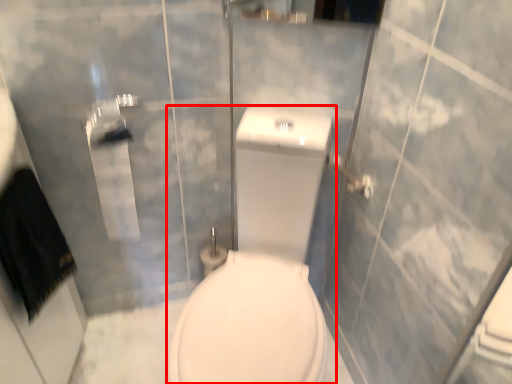
Question: From the image, what is the correct spatial relationship of porcelain (annotated by the red box) in relation to towel bar?

Choices:
 (A) left
 (B) right

Answer: (A)